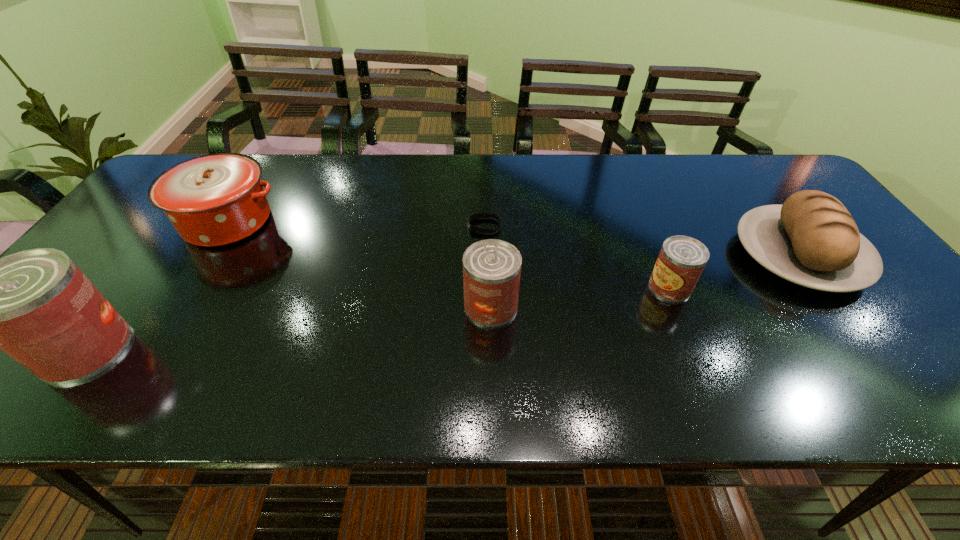
What are the coordinates of `object that is at the right edge` in the screenshot? It's located at (812, 240).

Locate an element on the screen. This screenshot has width=960, height=540. object that is at the far left corner is located at coordinates (213, 200).

Locate an element on the screen. object that is at the near left corner is located at coordinates (36, 305).

Where is `free space at the far edge`? This screenshot has width=960, height=540. free space at the far edge is located at coordinates (303, 190).

At what (x,y) coordinates should I click in order to perform the action: click on vacant space at the near edge of the desktop. Please return your answer as a coordinate pair (x, y). The image size is (960, 540). Looking at the image, I should click on (637, 339).

You are a GUI agent. You are given a task and a screenshot of the screen. Output one action in this format:
    pyautogui.click(x=<x>, y=<y>)
    Task: Click on the vacant space at the left edge of the desktop
    The height and width of the screenshot is (540, 960).
    Given the screenshot: What is the action you would take?
    pyautogui.click(x=143, y=232)

In the image, there is a desktop. At what (x,y) coordinates should I click in order to perform the action: click on vacant space at the near right corner. Please return your answer as a coordinate pair (x, y). The image size is (960, 540). Looking at the image, I should click on (863, 341).

The width and height of the screenshot is (960, 540). I want to click on vacant region between the second shortest object and the tallest object, so click(378, 318).

Find the location of a particular element. This screenshot has width=960, height=540. vacant area that lies between the tallest object and the shortest object is located at coordinates (285, 287).

Locate an element on the screen. The width and height of the screenshot is (960, 540). vacant area that lies between the shortest object and the leftmost can is located at coordinates (285, 287).